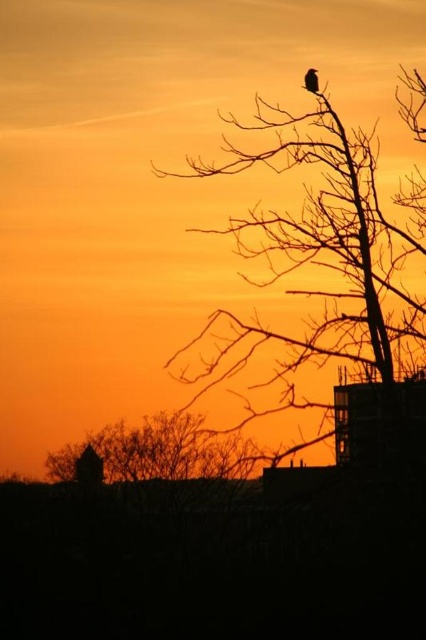
Can you confirm if silhouette bare tree at upper right is positioned to the right of brown/rough tree at lower center?

Indeed, silhouette bare tree at upper right is positioned on the right side of brown/rough tree at lower center.

Which of these two, silhouette bare tree at upper right or brown/rough tree at lower center, stands shorter?

With less height is brown/rough tree at lower center.

Is point (388, 349) positioned after point (126, 428)?

No, it is not.

I want to click on silhouette bare tree at upper right, so click(x=327, y=268).

Which is behind, point (305, 259) or point (317, 81)?

Point (305, 259)

Between silhouette bare tree at upper right and silhouette feathered bird at upper center, which one appears on the right side from the viewer's perspective?

silhouette bare tree at upper right

Does point (296, 404) come in front of point (310, 86)?

No, it is not.

In order to click on silhouette bare tree at upper right in this screenshot , I will do `click(327, 268)`.

Does point (250, 449) come farther from viewer compared to point (307, 81)?

Yes, it is behind point (307, 81).

Which is behind, point (149, 442) or point (313, 76)?

Positioned behind is point (149, 442).

This screenshot has height=640, width=426. What do you see at coordinates (160, 451) in the screenshot?
I see `brown/rough tree at lower center` at bounding box center [160, 451].

The height and width of the screenshot is (640, 426). Identify the location of brown/rough tree at lower center. (160, 451).